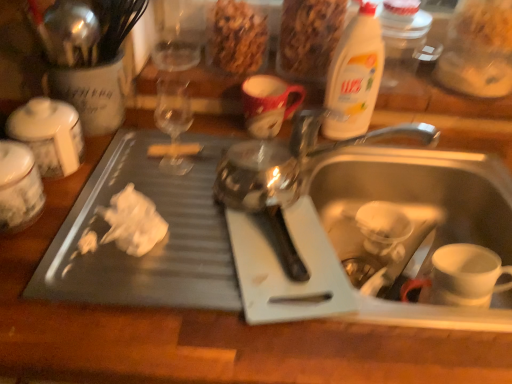
You are a GUI agent. You are given a task and a screenshot of the screen. Output one action in this format:
    pyautogui.click(x=<x>, y=<y>)
    Task: Click on the white matte coffee cup at sink bottom
    The height and width of the screenshot is (384, 512).
    Given the screenshot: What is the action you would take?
    pyautogui.click(x=462, y=276)

Find the location of `crumbly brown granola at upper center, which is the first food from left to right`. crumbly brown granola at upper center, which is the first food from left to right is located at coordinates (237, 37).

The height and width of the screenshot is (384, 512). I want to click on white plastic sink at lower right, so click(351, 221).

Find the location of `matte ceramic mug at upper center`. matte ceramic mug at upper center is located at coordinates (268, 104).

I want to click on white matte coffee cup at sink bottom, so click(x=462, y=276).

Based on the photo, is granular brown cereal at upper center, marked as the 2th food in a left-to-right arrangement, aimed at white plastic sink at lower right?

No, granular brown cereal at upper center, marked as the 2th food in a left-to-right arrangement, is not oriented towards white plastic sink at lower right.

Who is bigger, granular brown cereal at upper center, positioned as the first food in right-to-left order, or white plastic sink at lower right?

white plastic sink at lower right.

Does point (327, 8) lie in front of point (471, 218)?

Yes.

What's the angular difference between granular brown cereal at upper center, marked as the 2th food in a left-to-right arrangement, and white plastic sink at lower right's facing directions?

0.448 degrees.

Considering the sizes of objects matte ceramic mug at upper center and granular brown cereal at upper center, positioned as the first food in right-to-left order, in the image provided, who is taller, matte ceramic mug at upper center or granular brown cereal at upper center, positioned as the first food in right-to-left order,?

granular brown cereal at upper center, positioned as the first food in right-to-left order.

From the image's perspective, does matte ceramic mug at upper center appear higher than granular brown cereal at upper center, marked as the 2th food in a left-to-right arrangement?

No, from the image's perspective, matte ceramic mug at upper center is not above granular brown cereal at upper center, marked as the 2th food in a left-to-right arrangement.

Based on the photo, which is correct: matte ceramic mug at upper center is inside granular brown cereal at upper center, positioned as the first food in right-to-left order, or outside of it?

matte ceramic mug at upper center lies outside granular brown cereal at upper center, positioned as the first food in right-to-left order.

Considering the positions of objects white plastic sink at lower right and crumbly brown granola at upper center, arranged as the second food when viewed from the right, in the image provided, who is in front, white plastic sink at lower right or crumbly brown granola at upper center, arranged as the second food when viewed from the right,?

white plastic sink at lower right is more forward.

Where is `the 2nd food to the left of the white plastic sink at lower right, starting your count from the anchor`? the 2nd food to the left of the white plastic sink at lower right, starting your count from the anchor is located at coordinates (237, 37).

Is white plastic sink at lower right aimed at crumbly brown granola at upper center, arranged as the second food when viewed from the right?

No, white plastic sink at lower right is not facing towards crumbly brown granola at upper center, arranged as the second food when viewed from the right.

Measure the distance between white plastic sink at lower right and white matte coffee cup at sink bottom.

white plastic sink at lower right and white matte coffee cup at sink bottom are 7.48 inches apart.

Can you confirm if white plastic sink at lower right is shorter than white matte coffee cup at sink bottom?

In fact, white plastic sink at lower right may be taller than white matte coffee cup at sink bottom.

Does white plastic sink at lower right have a larger size compared to white matte coffee cup at sink bottom?

Yes.

Are white plastic sink at lower right and white matte coffee cup at sink bottom located far from each other?

No.

The image size is (512, 384). Identify the location of sink below the white plastic bottle at upper right (from a real-world perspective). (351, 221).

From the image's perspective, between white plastic sink at lower right and white plastic bottle at upper right, who is located below?

From the image's view, white plastic sink at lower right is below.

Which object is closer to the camera taking this photo, white plastic sink at lower right or white plastic bottle at upper right?

white plastic sink at lower right is closer to the camera.

Considering the sizes of white plastic sink at lower right and white plastic bottle at upper right in the image, is white plastic sink at lower right wider or thinner than white plastic bottle at upper right?

In the image, white plastic sink at lower right appears to be wider than white plastic bottle at upper right.

Is white matte coffee cup at sink bottom positioned far away from white plastic bottle at upper right?

No, there isn't a large distance between white matte coffee cup at sink bottom and white plastic bottle at upper right.

Where is `bottle that appears above the white matte coffee cup at sink bottom (from a real-world perspective)`? bottle that appears above the white matte coffee cup at sink bottom (from a real-world perspective) is located at coordinates (355, 75).

Visually, is white matte coffee cup at sink bottom positioned to the left or to the right of white plastic bottle at upper right?

In the image, white matte coffee cup at sink bottom appears on the right side of white plastic bottle at upper right.

From the image's perspective, who appears lower, white matte coffee cup at sink bottom or white plastic bottle at upper right?

white matte coffee cup at sink bottom, from the image's perspective.

Can you confirm if white matte coffee cup at sink bottom is thinner than matte ceramic mug at upper center?

No.

Does white matte coffee cup at sink bottom turn towards matte ceramic mug at upper center?

No, white matte coffee cup at sink bottom is not oriented towards matte ceramic mug at upper center.

Where is `mug that is above the white matte coffee cup at sink bottom (from a real-world perspective)`? Image resolution: width=512 pixels, height=384 pixels. mug that is above the white matte coffee cup at sink bottom (from a real-world perspective) is located at coordinates (268, 104).

Based on the photo, between white matte coffee cup at sink bottom and matte ceramic mug at upper center, which one is positioned behind?

matte ceramic mug at upper center is more distant.

From the white plastic sink at lower right, count the 1st food to the left and point to it. Please provide its 2D coordinates.

[(309, 37)]

You are a GUI agent. You are given a task and a screenshot of the screen. Output one action in this format:
    pyautogui.click(x=<x>, y=<y>)
    Task: Click on the mug below the granular brown cereal at upper center, marked as the 2th food in a left-to-right arrangement (from the image's perspective)
    Image resolution: width=512 pixels, height=384 pixels.
    Given the screenshot: What is the action you would take?
    pyautogui.click(x=268, y=104)

Consider the image. Estimate the real-world distances between objects in this image. Which object is further from white plastic bottle at upper right, matte ceramic mug at upper center or white plastic sink at lower right?

The object further to white plastic bottle at upper right is white plastic sink at lower right.

Estimate the real-world distances between objects in this image. Which object is closer to crumbly brown granola at upper center, which is the first food from left to right, white matte coffee cup at sink bottom or white plastic sink at lower right?

The object closer to crumbly brown granola at upper center, which is the first food from left to right, is white plastic sink at lower right.

Looking at the image, which one is located further to white plastic sink at lower right, white plastic bottle at upper right or white matte coffee cup at sink bottom?

The object further to white plastic sink at lower right is white plastic bottle at upper right.

Looking at the image, which one is located further to crumbly brown granola at upper center, arranged as the second food when viewed from the right, white matte coffee cup at sink bottom or white plastic bottle at upper right?

Among the two, white matte coffee cup at sink bottom is located further to crumbly brown granola at upper center, arranged as the second food when viewed from the right.

Which object lies further to the anchor point white plastic sink at lower right, granular brown cereal at upper center, positioned as the first food in right-to-left order, or white matte coffee cup at sink bottom?

granular brown cereal at upper center, positioned as the first food in right-to-left order, is positioned further to the anchor white plastic sink at lower right.

Considering their positions, is crumbly brown granola at upper center, arranged as the second food when viewed from the right, positioned further to white matte coffee cup at sink bottom than granular brown cereal at upper center, positioned as the first food in right-to-left order?

Based on the image, crumbly brown granola at upper center, arranged as the second food when viewed from the right, appears to be further to white matte coffee cup at sink bottom.

From the image, which object appears to be farther from white matte coffee cup at sink bottom, crumbly brown granola at upper center, which is the first food from left to right, or white plastic bottle at upper right?

Among the two, crumbly brown granola at upper center, which is the first food from left to right, is located further to white matte coffee cup at sink bottom.

From the image, which object appears to be farther from crumbly brown granola at upper center, arranged as the second food when viewed from the right, white matte coffee cup at sink bottom or matte ceramic mug at upper center?

white matte coffee cup at sink bottom is further to crumbly brown granola at upper center, arranged as the second food when viewed from the right.

The image size is (512, 384). What are the coordinates of `food situated between crumbly brown granola at upper center, arranged as the second food when viewed from the right, and white plastic bottle at upper right from left to right` in the screenshot? It's located at [x=309, y=37].

Where is `mug between white plastic bottle at upper right and white plastic sink at lower right vertically`? This screenshot has height=384, width=512. mug between white plastic bottle at upper right and white plastic sink at lower right vertically is located at coordinates (268, 104).

The height and width of the screenshot is (384, 512). I want to click on mug between granular brown cereal at upper center, positioned as the first food in right-to-left order, and white plastic sink at lower right in the up-down direction, so 268,104.

This screenshot has height=384, width=512. Identify the location of sink between white plastic bottle at upper right and white matte coffee cup at sink bottom in the vertical direction. (351, 221).